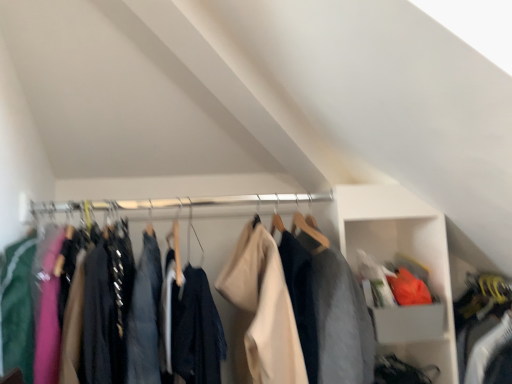
Question: From the image's perspective, is white plastic cabinet at upper right above or below matte black jacket at center?

Choices:
 (A) below
 (B) above

Answer: (A)

Question: Visually, is white plastic cabinet at upper right positioned to the left or to the right of matte black jacket at center?

Choices:
 (A) left
 (B) right

Answer: (B)

Question: Considering the positions of white plastic cabinet at upper right and matte black jacket at center in the image, is white plastic cabinet at upper right bigger or smaller than matte black jacket at center?

Choices:
 (A) small
 (B) big

Answer: (A)

Question: Relative to white plastic cabinet at upper right, is matte black jacket at center in front or behind?

Choices:
 (A) behind
 (B) front

Answer: (B)

Question: From a real-world perspective, is matte black jacket at center positioned above or below white plastic cabinet at upper right?

Choices:
 (A) below
 (B) above

Answer: (B)

Question: Is matte black jacket at center to the left or to the right of white plastic cabinet at upper right in the image?

Choices:
 (A) right
 (B) left

Answer: (B)

Question: Is point (232, 230) positioned closer to the camera than point (384, 249)?

Choices:
 (A) closer
 (B) farther

Answer: (A)